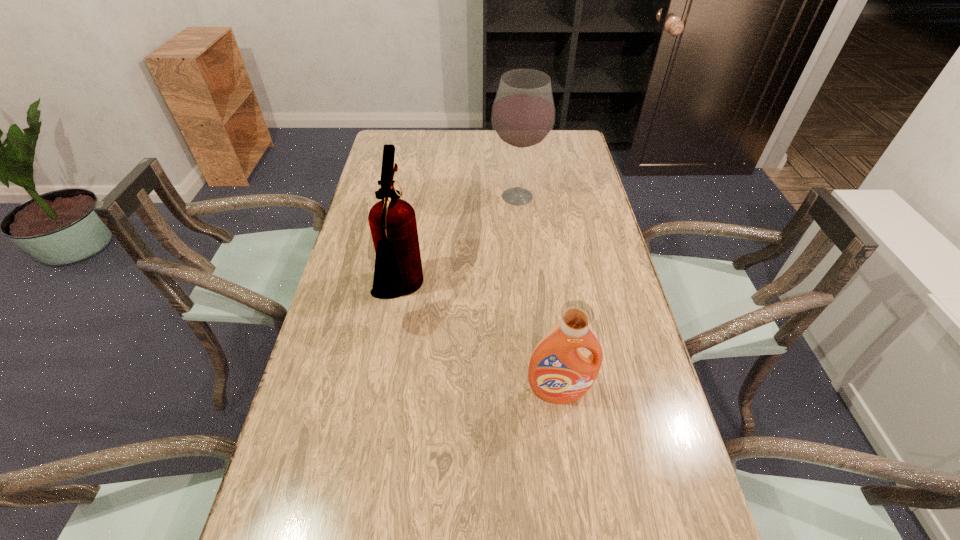
I want to click on the farthest object, so click(523, 114).

You are a GUI agent. You are given a task and a screenshot of the screen. Output one action in this format:
    pyautogui.click(x=<x>, y=<y>)
    Task: Click on the second farthest object
    This screenshot has width=960, height=540.
    Given the screenshot: What is the action you would take?
    pyautogui.click(x=398, y=271)

I want to click on the leftmost object, so click(x=398, y=271).

Locate an element on the screen. Image resolution: width=960 pixels, height=540 pixels. the nearest object is located at coordinates (559, 372).

You are a GUI agent. You are given a task and a screenshot of the screen. Output one action in this format:
    pyautogui.click(x=<x>, y=<y>)
    Task: Click on the detergent
    The height and width of the screenshot is (540, 960).
    Given the screenshot: What is the action you would take?
    pyautogui.click(x=559, y=372)

Where is `free spot located 0.130m on the front of the farthest object`? free spot located 0.130m on the front of the farthest object is located at coordinates (521, 239).

Where is `vacant space located at the nozzle of the leftmost object`? vacant space located at the nozzle of the leftmost object is located at coordinates 556,293.

Locate an element on the screen. free point located 0.070m on the front-facing side of the detergent is located at coordinates (564, 434).

Where is `object present at the left edge`? The image size is (960, 540). object present at the left edge is located at coordinates (398, 271).

Find the location of a particular element. object positioned at the right edge is located at coordinates (559, 372).